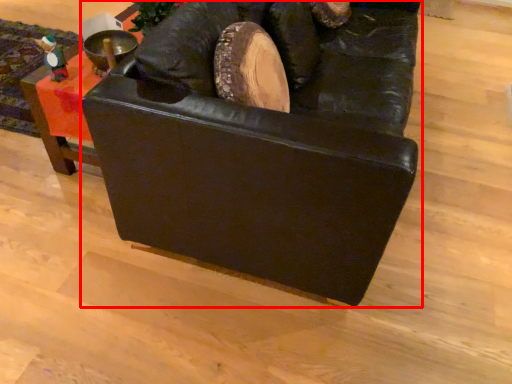
Question: From the image's perspective, what is the correct spatial positioning of furniture (annotated by the red box) in reference to furniture?

Choices:
 (A) above
 (B) below

Answer: (B)